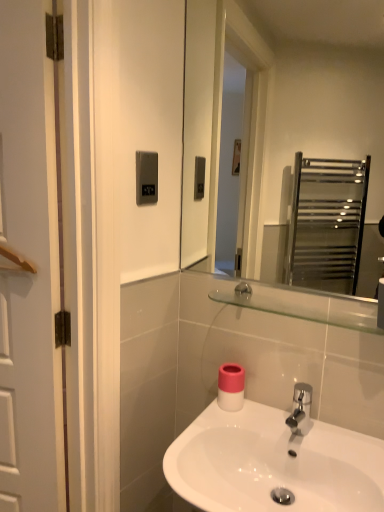
Locate an element on the screen. pink matte toilet paper at center is located at coordinates (231, 387).

Would you say clear glass shelf at upper center is part of white glossy sink at center's contents?

No, clear glass shelf at upper center is not surrounded by white glossy sink at center.

Considering the points (302, 440) and (358, 315), which point is in front, point (302, 440) or point (358, 315)?

Positioned in front is point (358, 315).

Looking at this image, looking at their sizes, would you say white glossy sink at center is wider or thinner than clear glass shelf at upper center?

Considering their sizes, white glossy sink at center looks broader than clear glass shelf at upper center.

How much distance is there between satin silver panel at upper center and clear glass mirror at upper center?

A distance of 3.57 feet exists between satin silver panel at upper center and clear glass mirror at upper center.

From the image's perspective, between satin silver panel at upper center and clear glass mirror at upper center, who is located below?

From the image's view, satin silver panel at upper center is below.

Which of these two, satin silver panel at upper center or clear glass mirror at upper center, is wider?

clear glass mirror at upper center is wider.

Could you tell me if satin silver panel at upper center is facing clear glass mirror at upper center?

No.

In terms of width, does pink matte toilet paper at center look wider or thinner when compared to clear glass mirror at upper center?

Clearly, pink matte toilet paper at center has more width compared to clear glass mirror at upper center.

Is pink matte toilet paper at center touching clear glass mirror at upper center?

No, pink matte toilet paper at center is not beside clear glass mirror at upper center.

From the picture: Is pink matte toilet paper at center not within clear glass mirror at upper center?

That's correct, pink matte toilet paper at center is outside of clear glass mirror at upper center.

Can you confirm if clear glass mirror at upper center is smaller than white glossy sink at center?

Yes, clear glass mirror at upper center is smaller than white glossy sink at center.

Does point (262, 180) come behind point (203, 508)?

Yes.

Is clear glass mirror at upper center facing away from white glossy sink at center?

No, clear glass mirror at upper center is not facing away from white glossy sink at center.

How different are the orientations of clear glass mirror at upper center and white glossy sink at center in degrees?

The angular difference between clear glass mirror at upper center and white glossy sink at center is 0.215 degrees.

Is clear glass shelf at upper center shorter than satin silver panel at upper center?

Indeed, clear glass shelf at upper center has a lesser height compared to satin silver panel at upper center.

From the picture: Is clear glass shelf at upper center positioned before satin silver panel at upper center?

Yes, the depth of clear glass shelf at upper center is less than that of satin silver panel at upper center.

Consider the image. Is clear glass shelf at upper center at the right side of satin silver panel at upper center?

Yes, clear glass shelf at upper center is to the right of satin silver panel at upper center.

From the image's perspective, is clear glass shelf at upper center located above or below satin silver panel at upper center?

clear glass shelf at upper center is situated lower than satin silver panel at upper center in the image.

Can clear glass shelf at upper center be found inside satin silver panel at upper center?

Definitely not — clear glass shelf at upper center is not inside satin silver panel at upper center.

Is satin silver panel at upper center facing away from clear glass shelf at upper center?

No, clear glass shelf at upper center is not at the back of satin silver panel at upper center.

Between satin silver panel at upper center and clear glass shelf at upper center, which one has more height?

satin silver panel at upper center is taller.

Which object is further away from the camera, satin silver panel at upper center or clear glass shelf at upper center?

satin silver panel at upper center is further from the camera.

Considering the relative positions of clear glass shelf at upper center and white glossy sink at center in the image provided, is clear glass shelf at upper center to the left of white glossy sink at center from the viewer's perspective?

No, clear glass shelf at upper center is not to the left of white glossy sink at center.

How distant is clear glass shelf at upper center from white glossy sink at center?

The distance of clear glass shelf at upper center from white glossy sink at center is 15.13 inches.

Is clear glass shelf at upper center next to white glossy sink at center?

They are not placed beside each other.

From a real-world perspective, who is located higher, clear glass shelf at upper center or white glossy sink at center?

In real-world perspective, clear glass shelf at upper center is above.

Locate an element on the screen. The width and height of the screenshot is (384, 512). sink in front of the clear glass shelf at upper center is located at coordinates (273, 463).

Locate an element on the screen. This screenshot has height=512, width=384. light switch behind the clear glass mirror at upper center is located at coordinates (146, 177).

Considering their positions, is pink matte toilet paper at center positioned closer to clear glass shelf at upper center than white glossy sink at center?

The object closer to clear glass shelf at upper center is pink matte toilet paper at center.

Which object lies further to the anchor point pink matte toilet paper at center, satin silver panel at upper center or clear glass shelf at upper center?

Based on the image, satin silver panel at upper center appears to be further to pink matte toilet paper at center.

Based on their spatial positions, is clear glass shelf at upper center or white glossy sink at center closer to clear glass mirror at upper center?

white glossy sink at center is closer to clear glass mirror at upper center.

Which object lies nearer to the anchor point satin silver panel at upper center, clear glass shelf at upper center or pink matte toilet paper at center?

clear glass shelf at upper center is positioned closer to the anchor satin silver panel at upper center.

Consider the image. When comparing their distances from clear glass mirror at upper center, does pink matte toilet paper at center or white glossy sink at center seem further?

pink matte toilet paper at center is positioned further to the anchor clear glass mirror at upper center.

Estimate the real-world distances between objects in this image. Which object is further from clear glass mirror at upper center, pink matte toilet paper at center or satin silver panel at upper center?

pink matte toilet paper at center is further to clear glass mirror at upper center.

Which object lies further to the anchor point clear glass mirror at upper center, white glossy sink at center or satin silver panel at upper center?

The object further to clear glass mirror at upper center is satin silver panel at upper center.

Estimate the real-world distances between objects in this image. Which object is closer to clear glass shelf at upper center, white glossy sink at center or satin silver panel at upper center?

white glossy sink at center lies closer to clear glass shelf at upper center than the other object.

I want to click on balustrade between satin silver panel at upper center and pink matte toilet paper at center in the vertical direction, so click(x=297, y=311).

Where is `balustrade between clear glass mirror at upper center and pink matte toilet paper at center in the vertical direction`? balustrade between clear glass mirror at upper center and pink matte toilet paper at center in the vertical direction is located at coordinates (297, 311).

What are the coordinates of `light switch between clear glass mirror at upper center and clear glass shelf at upper center in the vertical direction` in the screenshot? It's located at (146, 177).

The width and height of the screenshot is (384, 512). What are the coordinates of `light switch between clear glass mirror at upper center and white glossy sink at center in the vertical direction` in the screenshot? It's located at (146, 177).